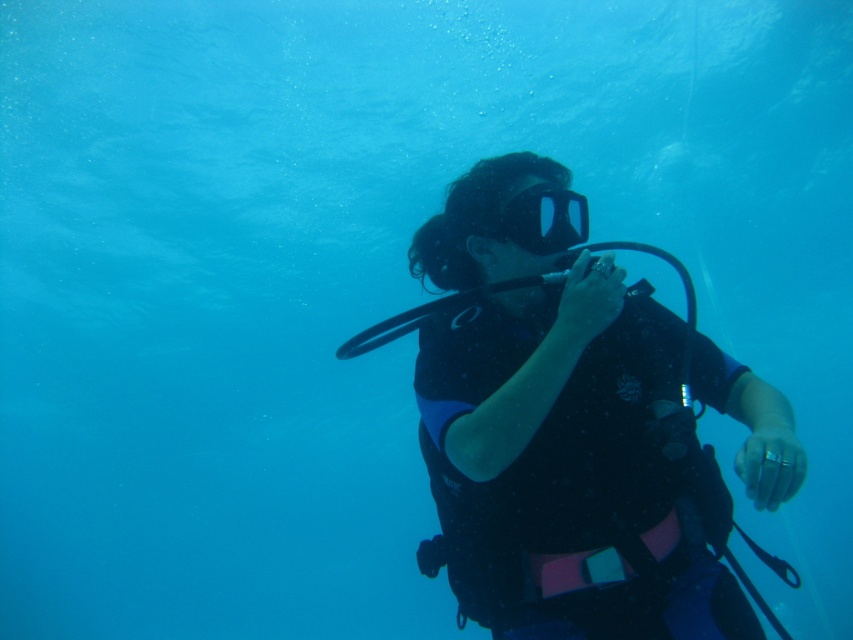
You are a marine biologist observing an underwater scene. You notice the black matte scuba diver at center and the transparent rubber mask at center. Can you determine which object is positioned lower in the water?

The black matte scuba diver at center is located below the transparent rubber mask at center, so the diver is positioned lower in the water.

You are a marine biologist observing the underwater scene. You notice the black matte scuba diver at center and the transparent rubber mask at center. Which object is closer to you from your observation point?

The black matte scuba diver at center is closer to you because it is in front of the transparent rubber mask at center.

You are a scuba diver in the underwater scene. You notice two points in the water. One is at point [647,340] and the other is at point [527,250]. If you want to reach the point closer to you, which one should you swim towards?

You should swim towards point [647,340] because it is closer to the camera than point [527,250].